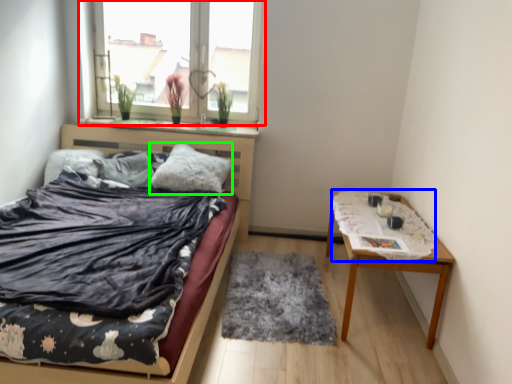
Question: Which object is the closest to the window (highlighted by a red box)? Choose among these: blanket (highlighted by a blue box) or pillow (highlighted by a green box).

Choices:
 (A) blanket
 (B) pillow

Answer: (B)